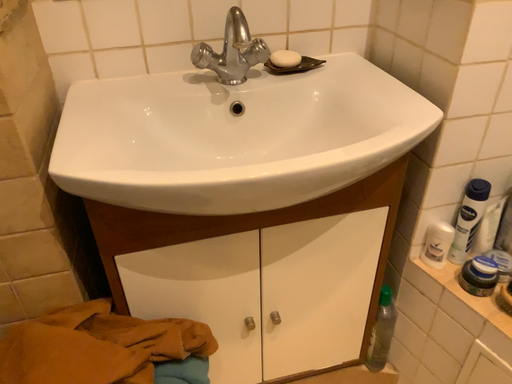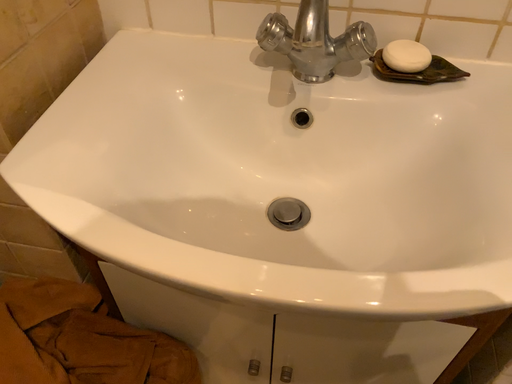
Question: Which way did the camera rotate in the video?

Choices:
 (A) rotated right
 (B) rotated left

Answer: (B)